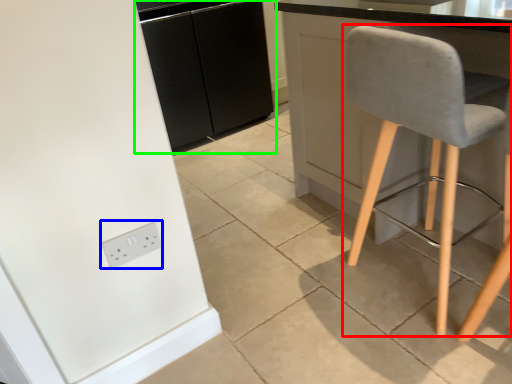
Question: Estimate the real-world distances between objects in this image. Which object is closer to chair (highlighted by a red box), socket (highlighted by a blue box) or cabinetry (highlighted by a green box)?

Choices:
 (A) socket
 (B) cabinetry

Answer: (A)